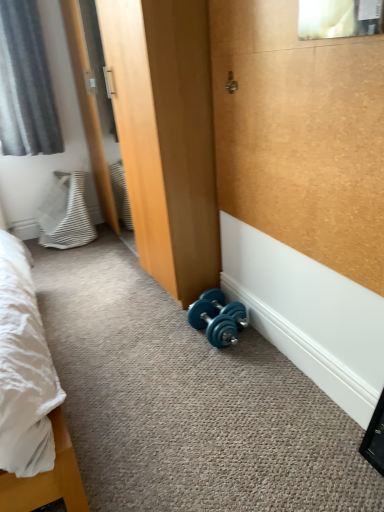
Where is `free space in front of teal rubber dumbbell at lower center`? The image size is (384, 512). free space in front of teal rubber dumbbell at lower center is located at coordinates (213, 369).